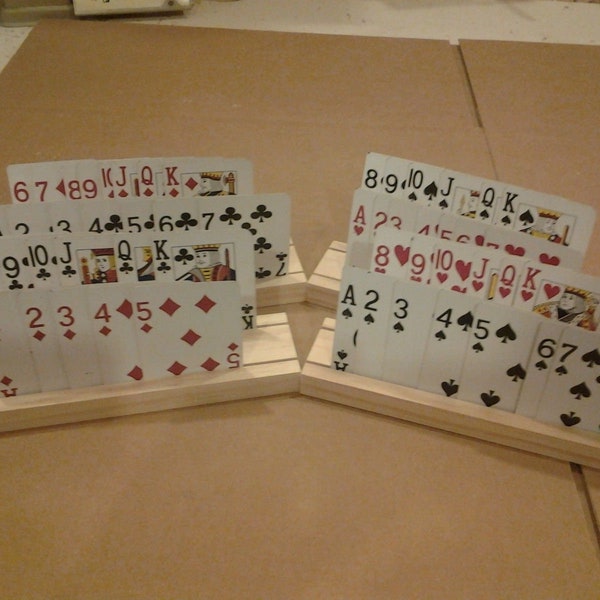
Identify the location of boards on the floor. (552, 299), (348, 95), (529, 109), (444, 112), (157, 79), (207, 507), (430, 512).